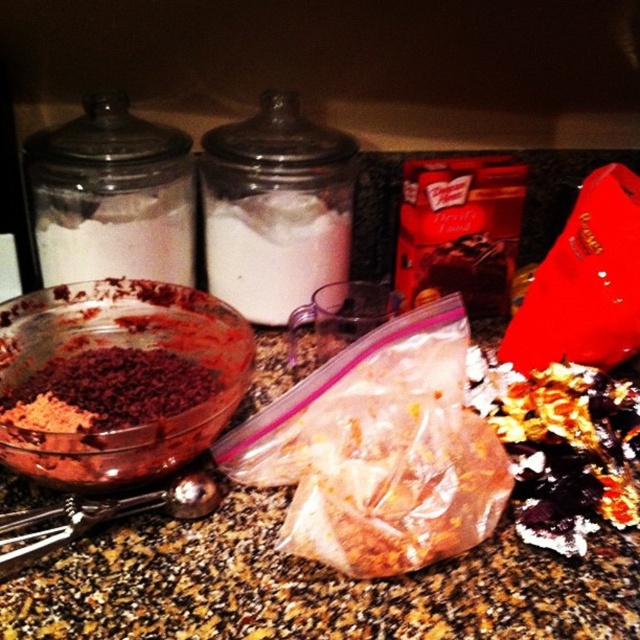
Question: Which point is closer to the camera taking this photo?

Choices:
 (A) (236, 253)
 (B) (99, 320)

Answer: (B)

Question: Which point appears closest to the camera in this image?

Choices:
 (A) (298, 192)
 (B) (204, 410)

Answer: (B)

Question: Can you confirm if translucent glass bowl at center-left is positioned to the left of white powder at center?

Choices:
 (A) no
 (B) yes

Answer: (B)

Question: Is translucent glass bowl at center-left bigger than white powder at center?

Choices:
 (A) no
 (B) yes

Answer: (B)

Question: Which point is closer to the camera?

Choices:
 (A) white powder at center
 (B) translucent glass bowl at center-left

Answer: (B)

Question: Is translucent glass bowl at center-left wider than white powder at center?

Choices:
 (A) yes
 (B) no

Answer: (A)